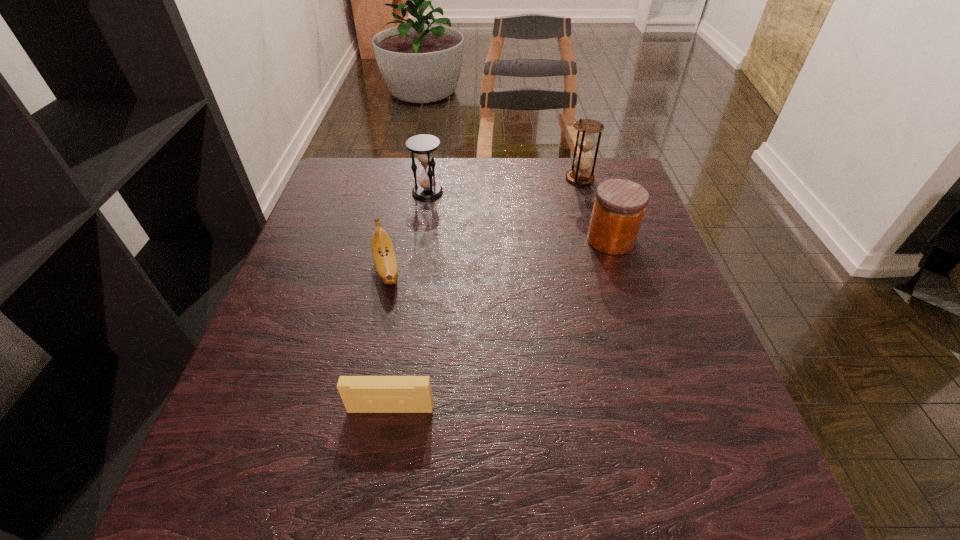
The width and height of the screenshot is (960, 540). I want to click on hourglass that is at the right edge, so click(586, 141).

This screenshot has width=960, height=540. In order to click on jar that is at the right edge in this screenshot , I will do `click(619, 206)`.

Locate an element on the screen. This screenshot has width=960, height=540. object present at the far right corner is located at coordinates (586, 141).

Where is `vacant space at the far edge of the desktop`? The image size is (960, 540). vacant space at the far edge of the desktop is located at coordinates (404, 194).

This screenshot has width=960, height=540. In the image, there is a desktop. What are the coordinates of `free space at the near edge` in the screenshot? It's located at (433, 509).

In the image, there is a desktop. Identify the location of vacant space at the left edge. The image size is (960, 540). (304, 241).

Image resolution: width=960 pixels, height=540 pixels. In order to click on vacant region at the right edge of the desktop in this screenshot , I will do `click(652, 343)`.

In the image, there is a desktop. Identify the location of free space at the far left corner. (324, 205).

The height and width of the screenshot is (540, 960). In order to click on free space at the near right corner of the desktop in this screenshot , I will do `click(698, 514)`.

Where is `vacant area between the left hourglass and the jar`? vacant area between the left hourglass and the jar is located at coordinates (519, 216).